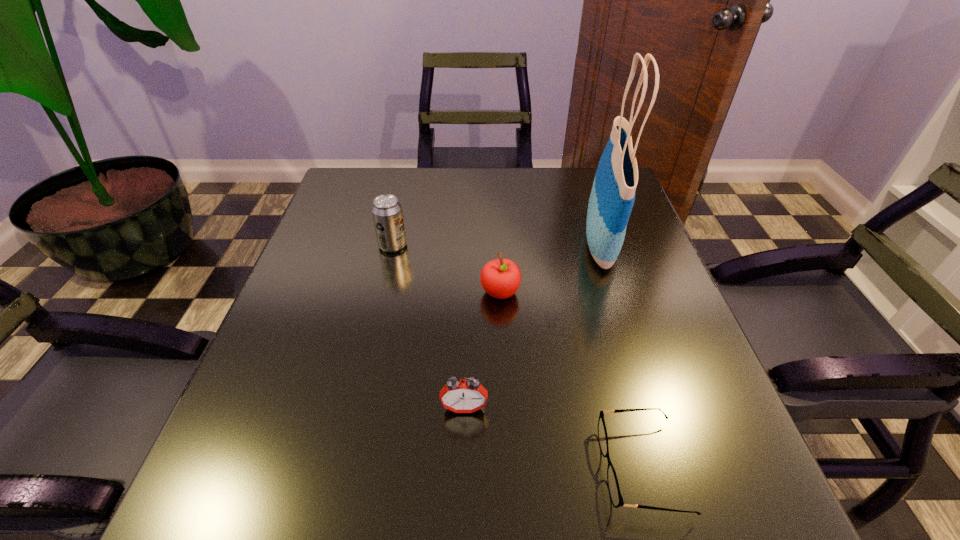
Where is `vacant space located 0.070m on the clock face of the alarm clock`? This screenshot has height=540, width=960. vacant space located 0.070m on the clock face of the alarm clock is located at coordinates (463, 457).

Where is `vacant space situated on the front-facing side of the nearest object`? Image resolution: width=960 pixels, height=540 pixels. vacant space situated on the front-facing side of the nearest object is located at coordinates (468, 468).

At what (x,y) coordinates should I click in order to perform the action: click on vacant space located 0.370m on the front-facing side of the nearest object. Please return your answer as a coordinate pair (x, y). Looking at the image, I should click on (365, 468).

Find the location of a particular element. The height and width of the screenshot is (540, 960). vacant space situated on the front-facing side of the nearest object is located at coordinates [x=345, y=468].

Where is `object at the far edge`? This screenshot has height=540, width=960. object at the far edge is located at coordinates (612, 197).

Find the location of a particular element. The image size is (960, 540). object located in the near edge section of the desktop is located at coordinates (614, 490).

Locate an element on the screen. tote bag that is at the right edge is located at coordinates (612, 197).

Locate an element on the screen. The height and width of the screenshot is (540, 960). spectacles situated at the right edge is located at coordinates (614, 490).

Locate an element on the screen. The height and width of the screenshot is (540, 960). object positioned at the far right corner is located at coordinates tap(612, 197).

In order to click on object present at the near right corner in this screenshot , I will do `click(614, 490)`.